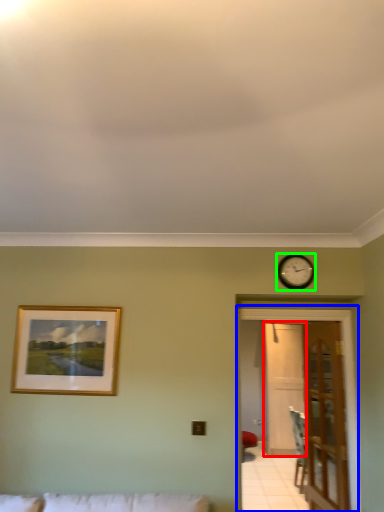
Question: Which object is positioned closest to glass door (highlighted by a red box)? Select from glass door (highlighted by a blue box) and wall clock (highlighted by a green box).

Choices:
 (A) glass door
 (B) wall clock

Answer: (A)